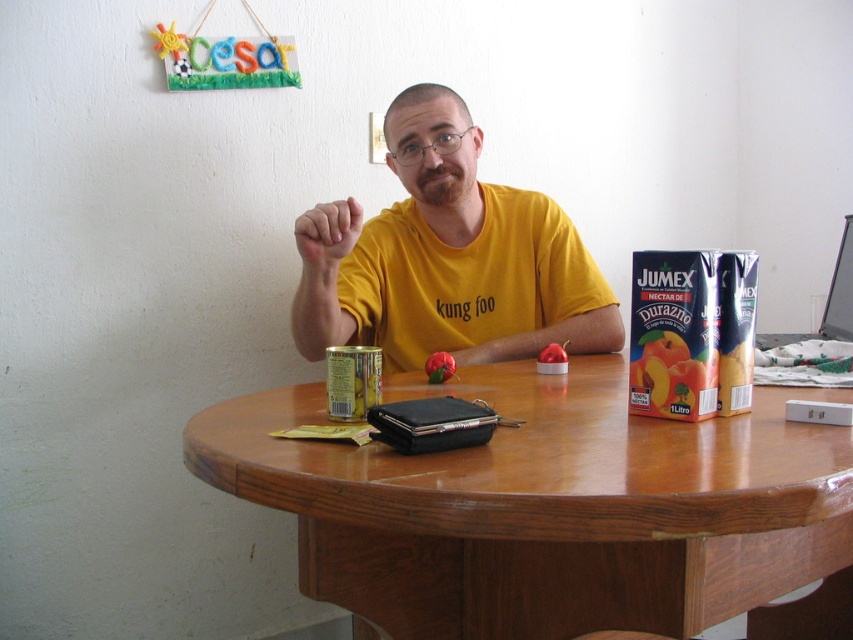
Question: Which of the following is the farthest from the observer?

Choices:
 (A) (779, 502)
 (B) (595, 323)

Answer: (B)

Question: Does wooden at center have a larger size compared to yellow matte shirt at center?

Choices:
 (A) no
 (B) yes

Answer: (B)

Question: Where is wooden at center located in relation to yellow matte shirt at center in the image?

Choices:
 (A) right
 (B) left

Answer: (A)

Question: Is wooden at center wider than yellow matte shirt at center?

Choices:
 (A) no
 (B) yes

Answer: (B)

Question: Which point appears closest to the camera in this image?

Choices:
 (A) (718, 433)
 (B) (352, 323)

Answer: (A)

Question: Among these points, which one is nearest to the camera?

Choices:
 (A) click(x=546, y=332)
 (B) click(x=837, y=460)

Answer: (B)